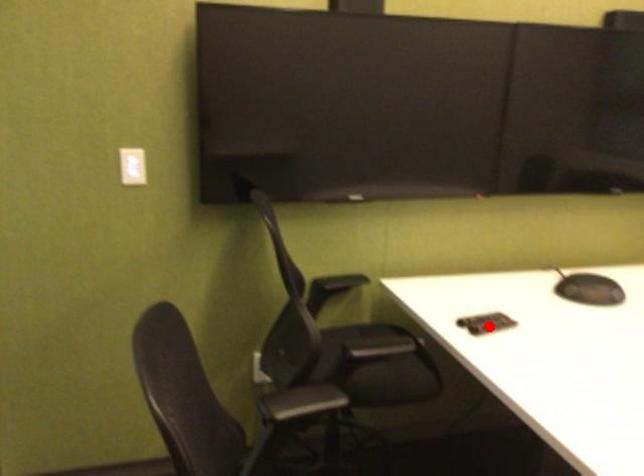
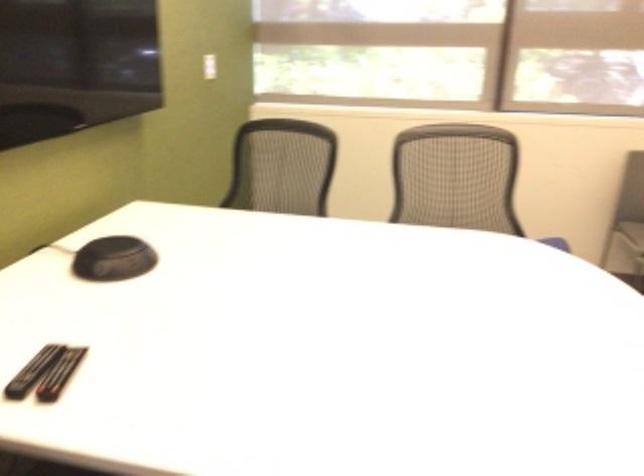
Question: A red point is marked in image1. In image2, is the corresponding 3D point closer to the camera or farther? Reply with the corresponding letter.

Choices:
 (A) The corresponding 3D point is closer.
 (B) The corresponding 3D point is farther.

Answer: (A)